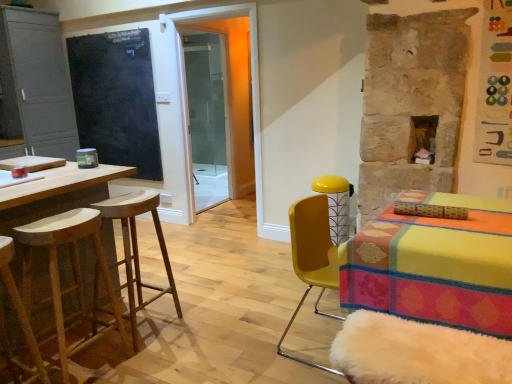
Locate an element on the screen. The height and width of the screenshot is (384, 512). vacant space to the right of wooden bar stool at left, arranged as the 1th stool when viewed from the back is located at coordinates (194, 328).